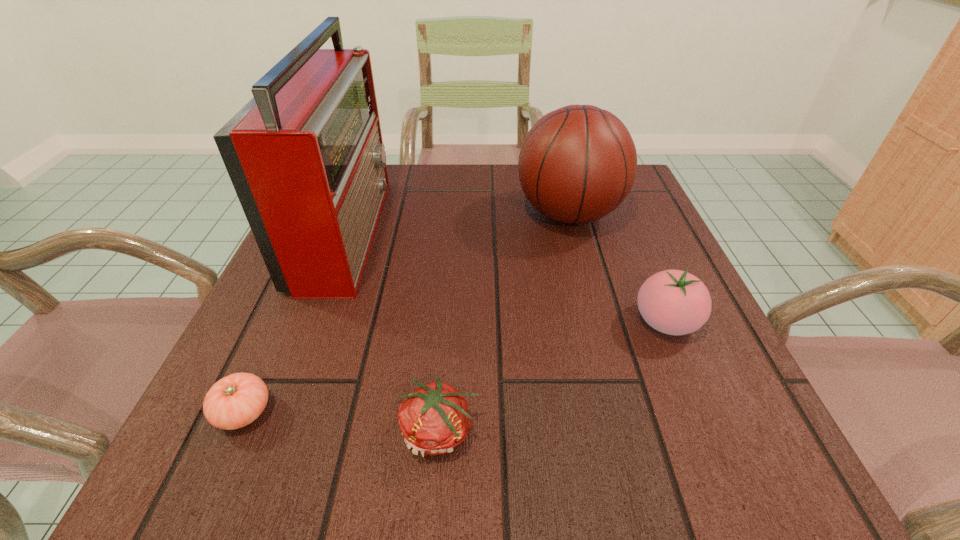
This screenshot has width=960, height=540. I want to click on empty space between the tallest object and the tallest tomato, so click(x=506, y=276).

Find the location of a particular element. vacant area that lies between the radio receiver and the tallest tomato is located at coordinates pos(506,276).

Find the location of a particular element. vacant area that lies between the rightmost tomato and the radio receiver is located at coordinates (506, 276).

Find the location of a particular element. This screenshot has width=960, height=540. vacant area that lies between the leftmost tomato and the second tomato from left to right is located at coordinates (342, 422).

Locate an element on the screen. Image resolution: width=960 pixels, height=540 pixels. free spot between the radio receiver and the fourth shortest object is located at coordinates (457, 222).

Identify the location of empty space that is in between the radio receiver and the shortest tomato. The height and width of the screenshot is (540, 960). (295, 321).

Locate an element on the screen. The height and width of the screenshot is (540, 960). vacant space that is in between the rightmost tomato and the radio receiver is located at coordinates (506, 276).

Where is `vacant space in between the basketball and the tallest tomato`? vacant space in between the basketball and the tallest tomato is located at coordinates (617, 268).

Locate an element on the screen. vacant area that lies between the leftmost tomato and the second shortest tomato is located at coordinates (342, 422).

Identify which object is located as the fourth nearest to the basketball. Please provide its 2D coordinates. Your answer should be formatted as a tuple, i.e. [(x, y)], where the tuple contains the x and y coordinates of a point satisfying the conditions above.

[(234, 401)]